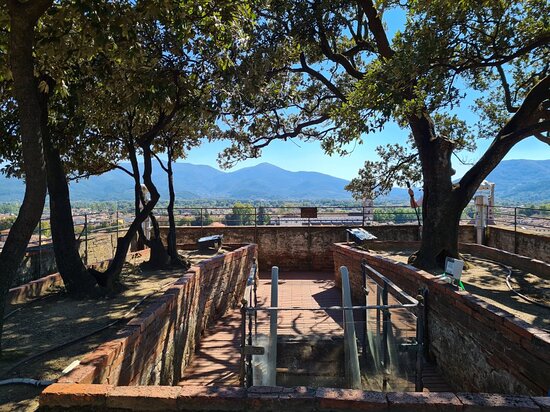
In order to click on stairs in this screenshot , I will do `click(311, 324)`, `click(313, 356)`, `click(309, 383)`.